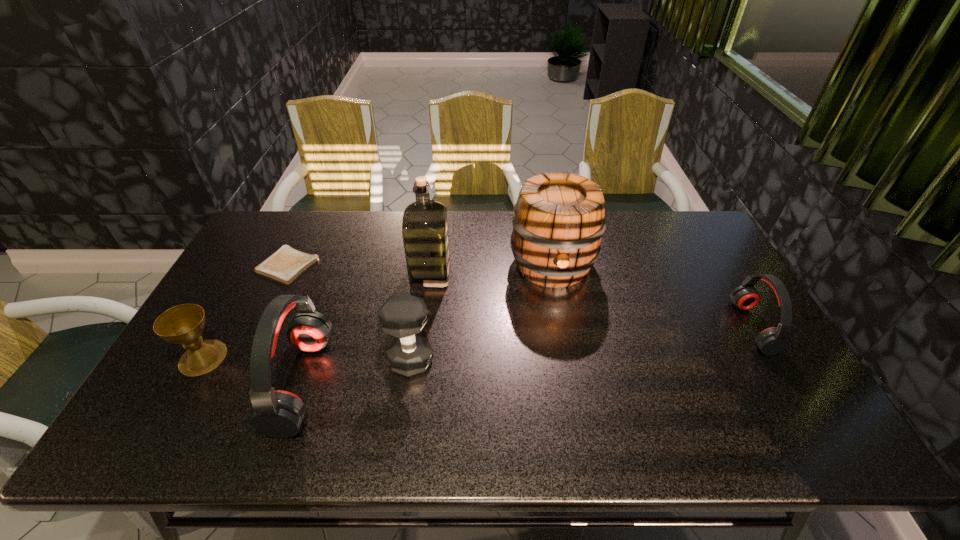
Find the location of a particular element. The width and height of the screenshot is (960, 540). location for an additional earphone to make spacing equal is located at coordinates (540, 353).